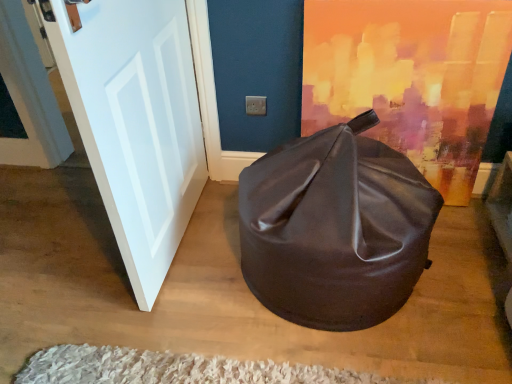
Question: Can you confirm if shiny brown bean bag at center is bigger than white glossy door at left?

Choices:
 (A) no
 (B) yes

Answer: (B)

Question: From the image's perspective, is shiny brown bean bag at center located above white glossy door at left?

Choices:
 (A) no
 (B) yes

Answer: (A)

Question: Can you confirm if shiny brown bean bag at center is wider than white glossy door at left?

Choices:
 (A) yes
 (B) no

Answer: (A)

Question: Is shiny brown bean bag at center taller than white glossy door at left?

Choices:
 (A) no
 (B) yes

Answer: (A)

Question: Could white glossy door at left be considered to be inside shiny brown bean bag at center?

Choices:
 (A) no
 (B) yes

Answer: (A)

Question: From the image's perspective, does shiny brown bean bag at center appear lower than white glossy door at left?

Choices:
 (A) yes
 (B) no

Answer: (A)

Question: From the image's perspective, is white glossy door at left located above white shaggy rug at lower center?

Choices:
 (A) yes
 (B) no

Answer: (A)

Question: Is the position of white glossy door at left more distant than that of white shaggy rug at lower center?

Choices:
 (A) no
 (B) yes

Answer: (A)

Question: Would you say white glossy door at left is outside white shaggy rug at lower center?

Choices:
 (A) no
 (B) yes

Answer: (B)

Question: From a real-world perspective, is white glossy door at left physically below white shaggy rug at lower center?

Choices:
 (A) yes
 (B) no

Answer: (B)

Question: Considering the relative positions of white glossy door at left and white shaggy rug at lower center in the image provided, is white glossy door at left to the right of white shaggy rug at lower center from the viewer's perspective?

Choices:
 (A) no
 (B) yes

Answer: (A)

Question: Does white glossy door at left have a greater width compared to white shaggy rug at lower center?

Choices:
 (A) yes
 (B) no

Answer: (B)

Question: Does white shaggy rug at lower center have a smaller size compared to white glossy door at left?

Choices:
 (A) no
 (B) yes

Answer: (B)